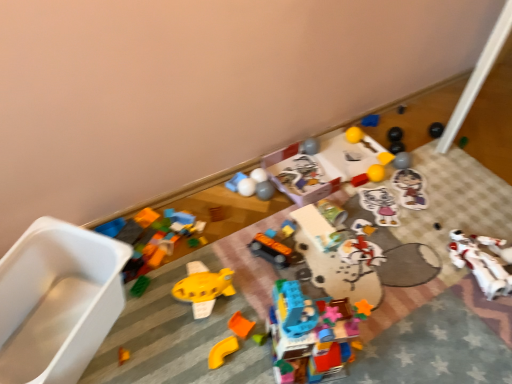
The image size is (512, 384). I want to click on vacant region to the left of yellow matte toy boat at center, which ranks as the 16th toy in right-to-left order, so click(144, 306).